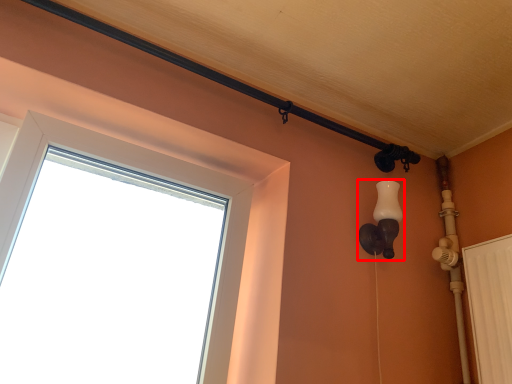
Question: Considering the relative positions of light fixture (annotated by the red box) and window in the image provided, where is light fixture (annotated by the red box) located with respect to the staircase?

Choices:
 (A) right
 (B) left

Answer: (A)